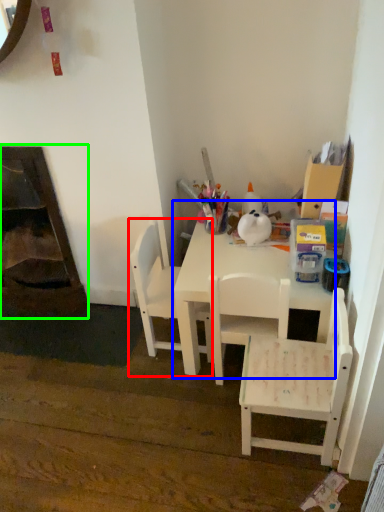
Question: Which object is the farthest from chair (highlighted by a red box)? Choose among these: table (highlighted by a blue box) or fireplace (highlighted by a green box).

Choices:
 (A) table
 (B) fireplace

Answer: (B)